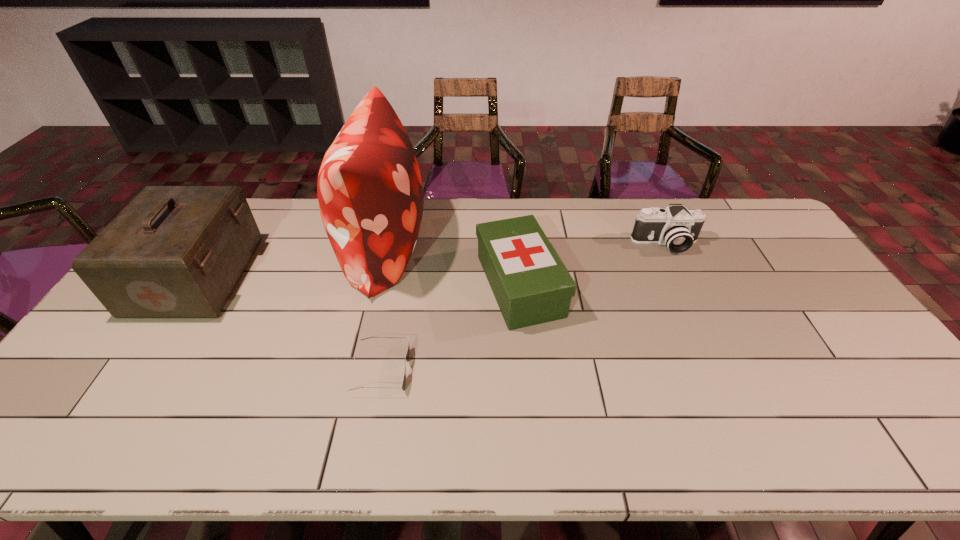
Where is `free point located 0.370m on the front of the rightmost object`? This screenshot has height=540, width=960. free point located 0.370m on the front of the rightmost object is located at coordinates (713, 347).

Locate an element on the screen. The width and height of the screenshot is (960, 540). vacant area located on the left of the fourth object from left to right is located at coordinates (357, 285).

This screenshot has width=960, height=540. In order to click on vacant area located on the front-facing side of the sunglasses in this screenshot , I will do `click(562, 370)`.

Find the location of a particular element. This screenshot has height=540, width=960. cushion that is at the far edge is located at coordinates (370, 193).

This screenshot has height=540, width=960. I want to click on camera that is positioned at the far edge, so click(x=678, y=228).

You are a GUI agent. You are given a task and a screenshot of the screen. Output one action in this format:
    pyautogui.click(x=<x>, y=<y>)
    Task: Click on the object that is positioned at the left edge
    This screenshot has height=540, width=960.
    Given the screenshot: What is the action you would take?
    pyautogui.click(x=174, y=251)

I want to click on vacant space at the near edge of the desktop, so click(246, 439).

Identify the location of vacant region at the left edge of the desktop. The image size is (960, 540). pyautogui.click(x=116, y=320).

The height and width of the screenshot is (540, 960). I want to click on vacant space at the right edge, so click(x=755, y=244).

Locate an element on the screen. This screenshot has height=540, width=960. vacant space at the far right corner is located at coordinates (744, 199).